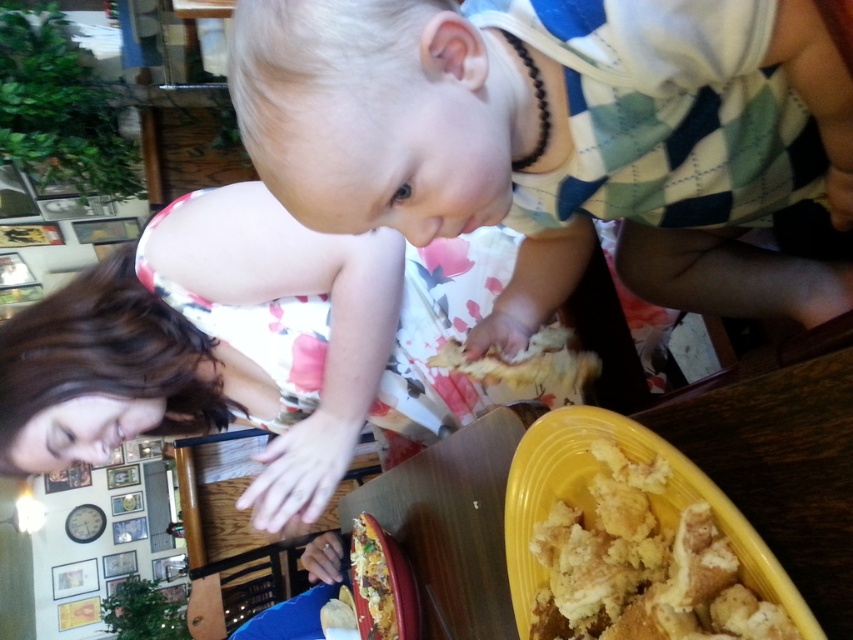
Question: Is soft white baby at center wider than golden crumbly bread at lower right?

Choices:
 (A) yes
 (B) no

Answer: (A)

Question: Does soft white baby at center have a lesser width compared to crumbly golden bread at lower center?

Choices:
 (A) no
 (B) yes

Answer: (A)

Question: Does golden crumbly bread at center have a greater width compared to crumbly golden bread at lower center?

Choices:
 (A) yes
 (B) no

Answer: (A)

Question: Which of the following is the farthest from the observer?

Choices:
 (A) (717, 115)
 (B) (401, 580)
 (C) (587, 563)
 (D) (479, 376)

Answer: (B)

Question: Among these points, which one is farthest from the camera?

Choices:
 (A) (556, 340)
 (B) (375, 627)

Answer: (B)

Question: Among these points, which one is nearest to the camera?

Choices:
 (A) (360, 220)
 (B) (708, 600)

Answer: (B)